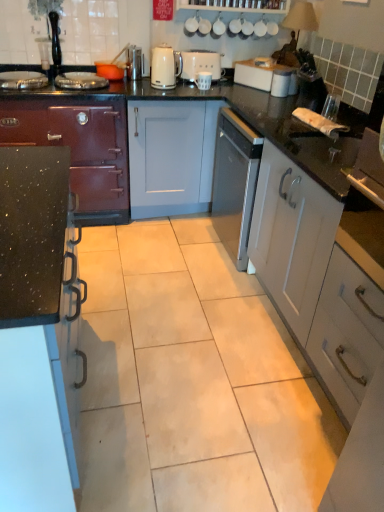
Question: In terms of height, does white matte mug at center, which is counted as the 1th appliance, starting from the right, look taller or shorter compared to white glossy kettle at upper center?

Choices:
 (A) short
 (B) tall

Answer: (A)

Question: From a real-world perspective, is white matte mug at center, which is counted as the 1th appliance, starting from the right, positioned above or below white glossy kettle at upper center?

Choices:
 (A) below
 (B) above

Answer: (A)

Question: Which object is the farthest from the white matte cabinet at right, which is counted as the 3th cabinetry, starting from the left?

Choices:
 (A) black speckled countertop at left, positioned as the second cabinetry in right-to-left order
 (B) white matte mug at center, positioned as the 3th appliance in left-to-right order
 (C) white plastic toaster at upper center
 (D) metallic silver toaster at upper center, which ranks as the 3th appliance in right-to-left order
 (E) white matte toaster at center, arranged as the 2th appliance when viewed from the right

Answer: (D)

Question: Estimate the real-world distances between objects in this image. Which object is closer to the black speckled countertop at left, the 2th cabinetry viewed from the left?

Choices:
 (A) white matte mug at center, positioned as the 3th appliance in left-to-right order
 (B) metallic silver toaster at upper center, which ranks as the 3th appliance in right-to-left order
 (C) matte black stove at left, the third cabinetry when ordered from right to left
 (D) white glossy kettle at upper center
 (E) white plastic toaster at upper center

Answer: (C)